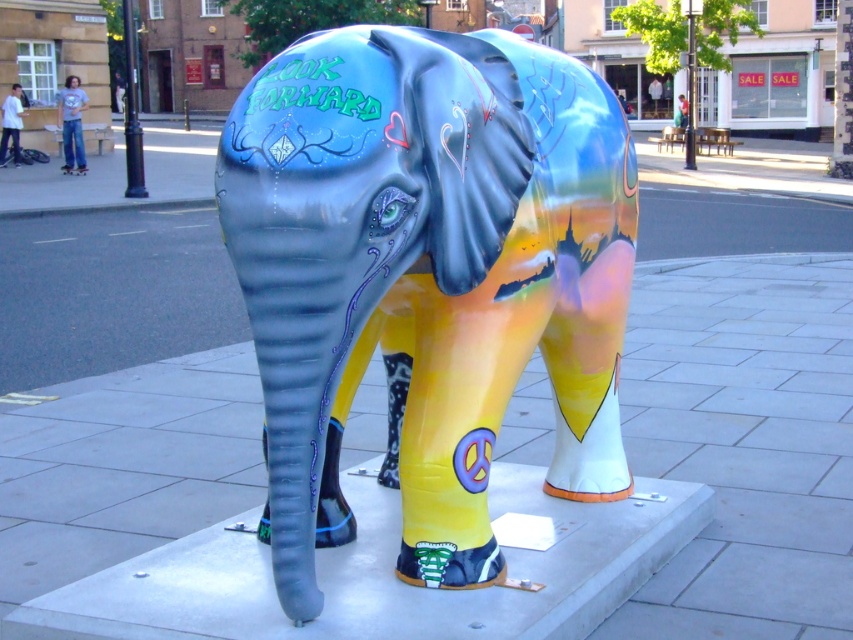
Who is positioned more to the right, shiny metallic elephant at center or smooth concrete elephant at center?

Positioned to the right is smooth concrete elephant at center.

Which is above, shiny metallic elephant at center or smooth concrete elephant at center?

shiny metallic elephant at center is above.

Find the location of a particular element. The height and width of the screenshot is (640, 853). shiny metallic elephant at center is located at coordinates coord(427,275).